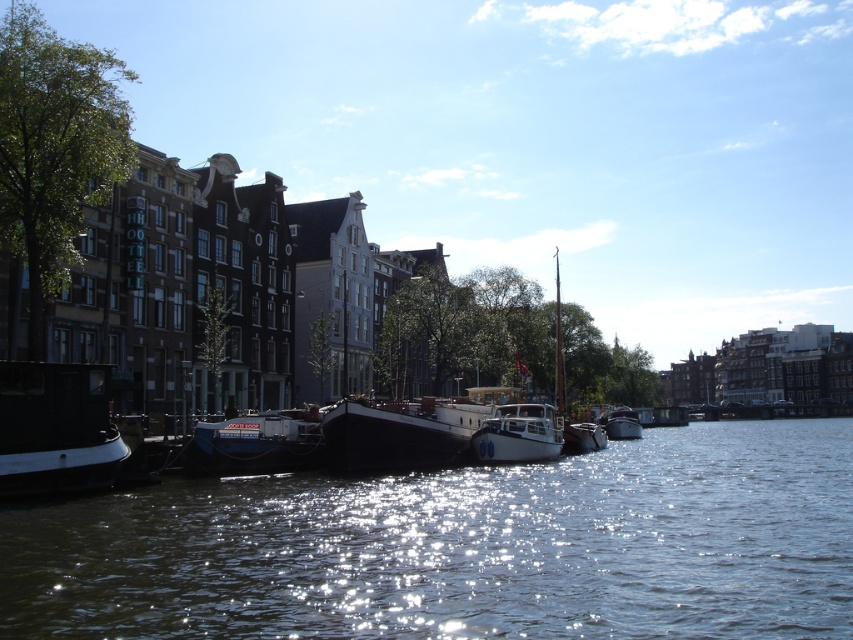
You are standing at the point with coordinates (56,428) in the canal scene. Which object is exactly at your current location?

The shiny black boat at lower left is exactly at the point (56,428).

You are a photographer standing on the shore of the canal. You want to capture a photo that includes both the shiny black boat at lower left and the shiny white boat at center. Which boat will appear larger in the photo due to its height?

The shiny black boat at lower left is taller than the shiny white boat at center, so it will appear larger in the photo.

You are a tour guide leading a group along the canal. You want to inform your tourists about the distance between the shiny dark water at lower center and the blue matte boat at center. How far apart are they?

The distance between the shiny dark water at lower center and the blue matte boat at center is 13.73 meters.